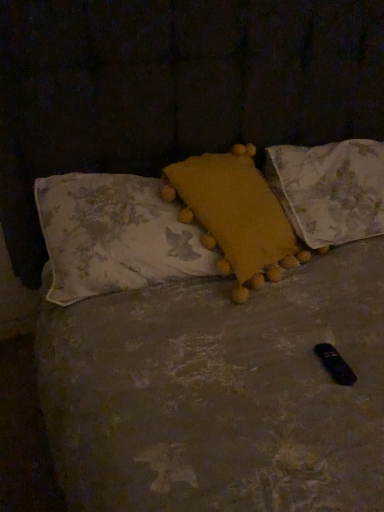
What is the approximate width of yellow fabric pillow at upper right, which is the first pillow from right to left?

16.88 inches.

Measure the distance between yellow fabric pillow at upper right, which is the first pillow from right to left, and camera.

yellow fabric pillow at upper right, which is the first pillow from right to left, is 1.28 meters from camera.

What are the coordinates of `yellow fuzzy pillow at center, marked as the second pillow in a right-to-left arrangement` in the screenshot? It's located at (235, 216).

Is yellow fabric pillow at upper right, which is the first pillow from right to left, positioned with its back to yellow fuzzy pillow at center, the second pillow in the left-to-right sequence?

No, yellow fabric pillow at upper right, which is the first pillow from right to left, is not facing the opposite direction of yellow fuzzy pillow at center, the second pillow in the left-to-right sequence.

At what (x,y) coordinates should I click in order to perform the action: click on pillow lying behind the yellow fuzzy pillow at center, the second pillow in the left-to-right sequence. Please return your answer as a coordinate pair (x, y). This screenshot has width=384, height=512. Looking at the image, I should click on (330, 189).

From the image's perspective, which one is positioned lower, yellow fabric pillow at upper right, arranged as the 3th pillow when viewed from the left, or yellow fuzzy pillow at center, marked as the second pillow in a right-to-left arrangement?

From the image's view, yellow fuzzy pillow at center, marked as the second pillow in a right-to-left arrangement, is below.

In the scene shown: Would you say yellow fabric pillow at upper right, which is the first pillow from right to left, is to the left or to the right of yellow fuzzy pillow at center, the second pillow in the left-to-right sequence, in the picture?

In the image, yellow fabric pillow at upper right, which is the first pillow from right to left, appears on the right side of yellow fuzzy pillow at center, the second pillow in the left-to-right sequence.

Considering the relative positions of fluffy yellow pillow at center, which is the first pillow from left to right, and yellow fabric pillow at upper right, arranged as the 3th pillow when viewed from the left, in the image provided, is fluffy yellow pillow at center, which is the first pillow from left to right, to the right of yellow fabric pillow at upper right, arranged as the 3th pillow when viewed from the left, from the viewer's perspective?

In fact, fluffy yellow pillow at center, which is the first pillow from left to right, is to the left of yellow fabric pillow at upper right, arranged as the 3th pillow when viewed from the left.

From the picture: Is fluffy yellow pillow at center, which is the first pillow from left to right, positioned with its back to yellow fabric pillow at upper right, arranged as the 3th pillow when viewed from the left?

fluffy yellow pillow at center, which is the first pillow from left to right, is not turned away from yellow fabric pillow at upper right, arranged as the 3th pillow when viewed from the left.

How far apart are fluffy yellow pillow at center, which is the 3th pillow from right to left, and yellow fabric pillow at upper right, arranged as the 3th pillow when viewed from the left?

fluffy yellow pillow at center, which is the 3th pillow from right to left, is 20.49 inches away from yellow fabric pillow at upper right, arranged as the 3th pillow when viewed from the left.

Who is smaller, fluffy yellow pillow at center, which is the 3th pillow from right to left, or yellow fabric pillow at upper right, which is the first pillow from right to left?

With smaller size is fluffy yellow pillow at center, which is the 3th pillow from right to left.

Considering the sizes of yellow fuzzy pillow at center, the second pillow in the left-to-right sequence, and fluffy yellow pillow at center, which is the first pillow from left to right, in the image, is yellow fuzzy pillow at center, the second pillow in the left-to-right sequence, wider or thinner than fluffy yellow pillow at center, which is the first pillow from left to right,?

Considering their sizes, yellow fuzzy pillow at center, the second pillow in the left-to-right sequence, looks broader than fluffy yellow pillow at center, which is the first pillow from left to right.

From the picture: From a real-world perspective, which is physically below, yellow fuzzy pillow at center, marked as the second pillow in a right-to-left arrangement, or fluffy yellow pillow at center, which is the first pillow from left to right?

fluffy yellow pillow at center, which is the first pillow from left to right.

Is yellow fuzzy pillow at center, the second pillow in the left-to-right sequence, oriented towards fluffy yellow pillow at center, which is the 3th pillow from right to left?

Yes, yellow fuzzy pillow at center, the second pillow in the left-to-right sequence, is facing fluffy yellow pillow at center, which is the 3th pillow from right to left.

Can you see yellow fuzzy pillow at center, marked as the second pillow in a right-to-left arrangement, touching fluffy yellow pillow at center, which is the first pillow from left to right?

No, yellow fuzzy pillow at center, marked as the second pillow in a right-to-left arrangement, is not beside fluffy yellow pillow at center, which is the first pillow from left to right.

Looking at this image, from the image's perspective, relative to yellow fuzzy pillow at center, marked as the second pillow in a right-to-left arrangement, is fluffy yellow pillow at center, which is the first pillow from left to right, above or below?

fluffy yellow pillow at center, which is the first pillow from left to right, is below yellow fuzzy pillow at center, marked as the second pillow in a right-to-left arrangement.

From a real-world perspective, between fluffy yellow pillow at center, which is the first pillow from left to right, and yellow fuzzy pillow at center, the second pillow in the left-to-right sequence, who is vertically higher?

yellow fuzzy pillow at center, the second pillow in the left-to-right sequence, is physically above.

Looking at this image, does fluffy yellow pillow at center, which is the 3th pillow from right to left, have a greater height compared to yellow fuzzy pillow at center, the second pillow in the left-to-right sequence?

In fact, fluffy yellow pillow at center, which is the 3th pillow from right to left, may be shorter than yellow fuzzy pillow at center, the second pillow in the left-to-right sequence.

Is fluffy yellow pillow at center, which is the first pillow from left to right, wider or thinner than yellow fuzzy pillow at center, the second pillow in the left-to-right sequence?

Considering their sizes, fluffy yellow pillow at center, which is the first pillow from left to right, looks slimmer than yellow fuzzy pillow at center, the second pillow in the left-to-right sequence.

Can you confirm if yellow fuzzy pillow at center, marked as the second pillow in a right-to-left arrangement, is wider than yellow fabric pillow at upper right, arranged as the 3th pillow when viewed from the left?

In fact, yellow fuzzy pillow at center, marked as the second pillow in a right-to-left arrangement, might be narrower than yellow fabric pillow at upper right, arranged as the 3th pillow when viewed from the left.

Is yellow fuzzy pillow at center, marked as the second pillow in a right-to-left arrangement, closer to the viewer compared to yellow fabric pillow at upper right, which is the first pillow from right to left?

Yes, yellow fuzzy pillow at center, marked as the second pillow in a right-to-left arrangement, is in front of yellow fabric pillow at upper right, which is the first pillow from right to left.

How much distance is there between yellow fuzzy pillow at center, the second pillow in the left-to-right sequence, and yellow fabric pillow at upper right, arranged as the 3th pillow when viewed from the left?

yellow fuzzy pillow at center, the second pillow in the left-to-right sequence, and yellow fabric pillow at upper right, arranged as the 3th pillow when viewed from the left, are 8.89 inches apart.

Which is nearer, (219, 161) or (368, 155)?

Point (219, 161).

Is yellow fabric pillow at upper right, arranged as the 3th pillow when viewed from the left, further to camera compared to fluffy yellow pillow at center, which is the 3th pillow from right to left?

That is True.

From a real-world perspective, which pillow is the 1st one above the yellow fabric pillow at upper right, arranged as the 3th pillow when viewed from the left? Please provide its 2D coordinates.

[(114, 236)]

Is yellow fabric pillow at upper right, arranged as the 3th pillow when viewed from the left, taller than fluffy yellow pillow at center, which is the first pillow from left to right?

Yes, yellow fabric pillow at upper right, arranged as the 3th pillow when viewed from the left, is taller than fluffy yellow pillow at center, which is the first pillow from left to right.

Is fluffy yellow pillow at center, which is the 3th pillow from right to left, at the back of yellow fabric pillow at upper right, arranged as the 3th pillow when viewed from the left?

That's not correct — yellow fabric pillow at upper right, arranged as the 3th pillow when viewed from the left, is not looking away from fluffy yellow pillow at center, which is the 3th pillow from right to left.

Locate an element on the screen. This screenshot has height=512, width=384. the 1st pillow in front when counting from the yellow fabric pillow at upper right, which is the first pillow from right to left is located at coordinates (235, 216).

Starting from the yellow fabric pillow at upper right, arranged as the 3th pillow when viewed from the left, which pillow is the 2nd one to the left? Please provide its 2D coordinates.

[(114, 236)]

Estimate the real-world distances between objects in this image. Which object is further from yellow fuzzy pillow at center, marked as the second pillow in a right-to-left arrangement, yellow fabric pillow at upper right, which is the first pillow from right to left, or fluffy yellow pillow at center, which is the 3th pillow from right to left?

yellow fabric pillow at upper right, which is the first pillow from right to left, lies further to yellow fuzzy pillow at center, marked as the second pillow in a right-to-left arrangement, than the other object.

From the image, which object appears to be farther from yellow fuzzy pillow at center, the second pillow in the left-to-right sequence, fluffy yellow pillow at center, which is the first pillow from left to right, or yellow fabric pillow at upper right, arranged as the 3th pillow when viewed from the left?

yellow fabric pillow at upper right, arranged as the 3th pillow when viewed from the left, lies further to yellow fuzzy pillow at center, the second pillow in the left-to-right sequence, than the other object.

From the image, which object appears to be nearer to fluffy yellow pillow at center, which is the first pillow from left to right, yellow fabric pillow at upper right, arranged as the 3th pillow when viewed from the left, or yellow fuzzy pillow at center, marked as the second pillow in a right-to-left arrangement?

yellow fuzzy pillow at center, marked as the second pillow in a right-to-left arrangement, is closer to fluffy yellow pillow at center, which is the first pillow from left to right.

Based on their spatial positions, is fluffy yellow pillow at center, which is the first pillow from left to right, or yellow fuzzy pillow at center, the second pillow in the left-to-right sequence, further from yellow fabric pillow at upper right, arranged as the 3th pillow when viewed from the left?

fluffy yellow pillow at center, which is the first pillow from left to right.

From the image, which object appears to be farther from yellow fabric pillow at upper right, which is the first pillow from right to left, yellow fuzzy pillow at center, marked as the second pillow in a right-to-left arrangement, or fluffy yellow pillow at center, which is the 3th pillow from right to left?

fluffy yellow pillow at center, which is the 3th pillow from right to left, is positioned further to the anchor yellow fabric pillow at upper right, which is the first pillow from right to left.

Estimate the real-world distances between objects in this image. Which object is further from fluffy yellow pillow at center, which is the first pillow from left to right, yellow fuzzy pillow at center, the second pillow in the left-to-right sequence, or yellow fabric pillow at upper right, arranged as the 3th pillow when viewed from the left?

Based on the image, yellow fabric pillow at upper right, arranged as the 3th pillow when viewed from the left, appears to be further to fluffy yellow pillow at center, which is the first pillow from left to right.

The height and width of the screenshot is (512, 384). What are the coordinates of `pillow between fluffy yellow pillow at center, which is the 3th pillow from right to left, and yellow fabric pillow at upper right, arranged as the 3th pillow when viewed from the left` in the screenshot? It's located at (235, 216).